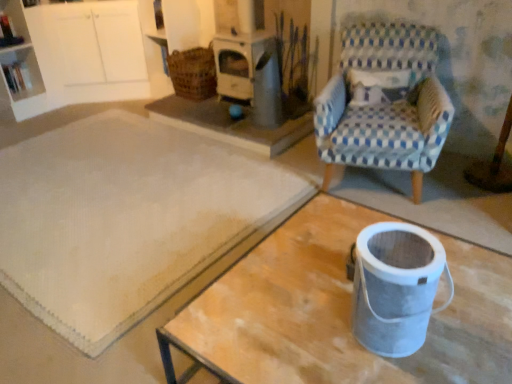
The height and width of the screenshot is (384, 512). I want to click on vacant area in front of woven brown basket at upper center, so click(193, 111).